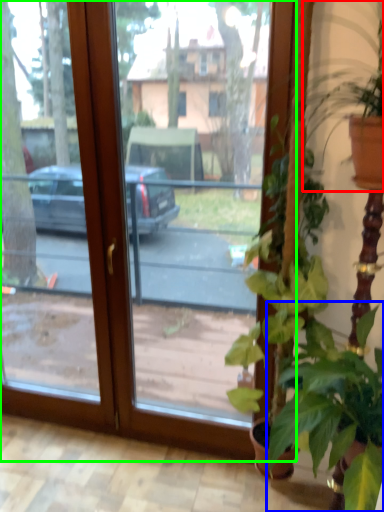
Question: Which object is the closest to the houseplant (highlighted by a red box)? Choose among these: houseplant (highlighted by a blue box) or window (highlighted by a green box).

Choices:
 (A) houseplant
 (B) window

Answer: (A)